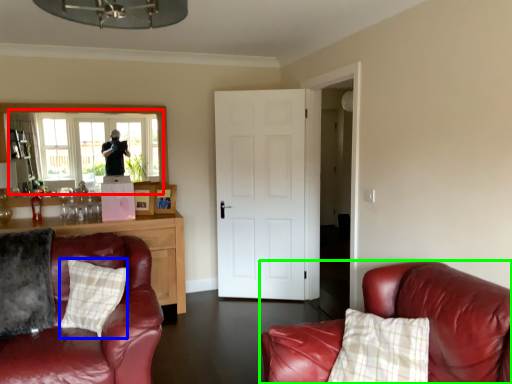
Question: Which is nearer to the window (highlighted by a red box)? pillow (highlighted by a blue box) or studio couch (highlighted by a green box).

Choices:
 (A) pillow
 (B) studio couch

Answer: (A)